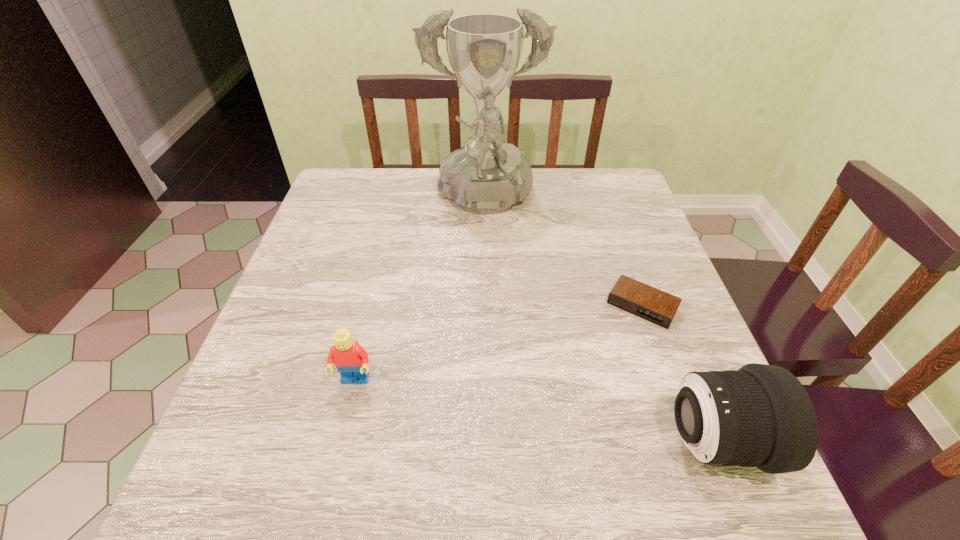
The height and width of the screenshot is (540, 960). I want to click on free spot on the desktop that is between the Lego and the third shortest object and is positioned on the front face of the second farthest object, so click(579, 418).

Where is `vacant space on the desktop that is between the second nearest object and the nearest object and is positioned on the side with emblem of the second object from left to right`? This screenshot has height=540, width=960. vacant space on the desktop that is between the second nearest object and the nearest object and is positioned on the side with emblem of the second object from left to right is located at coordinates point(504,406).